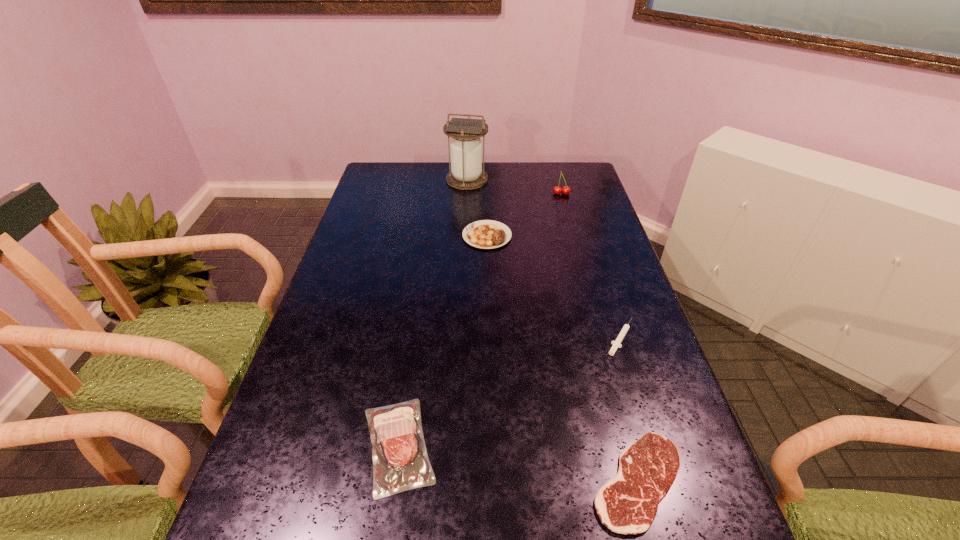
Identify the location of lantern. The width and height of the screenshot is (960, 540). (466, 173).

The height and width of the screenshot is (540, 960). Identify the location of the tallest object. (466, 173).

Where is `the second tallest object`? The width and height of the screenshot is (960, 540). the second tallest object is located at coordinates (557, 190).

Locate an element on the screen. The height and width of the screenshot is (540, 960). cherry is located at coordinates (557, 190).

Find the location of a particular element. the tallest steak is located at coordinates (487, 234).

Find the location of `the third tallest object`. the third tallest object is located at coordinates (487, 234).

Image resolution: width=960 pixels, height=540 pixels. Identify the location of the leftmost steak. (398, 446).

Where is `the third shortest object`? Image resolution: width=960 pixels, height=540 pixels. the third shortest object is located at coordinates (398, 446).

Locate an element on the screen. Image resolution: width=960 pixels, height=540 pixels. the fourth farthest object is located at coordinates (616, 344).

Find the location of a particular element. the second shortest object is located at coordinates (616, 344).